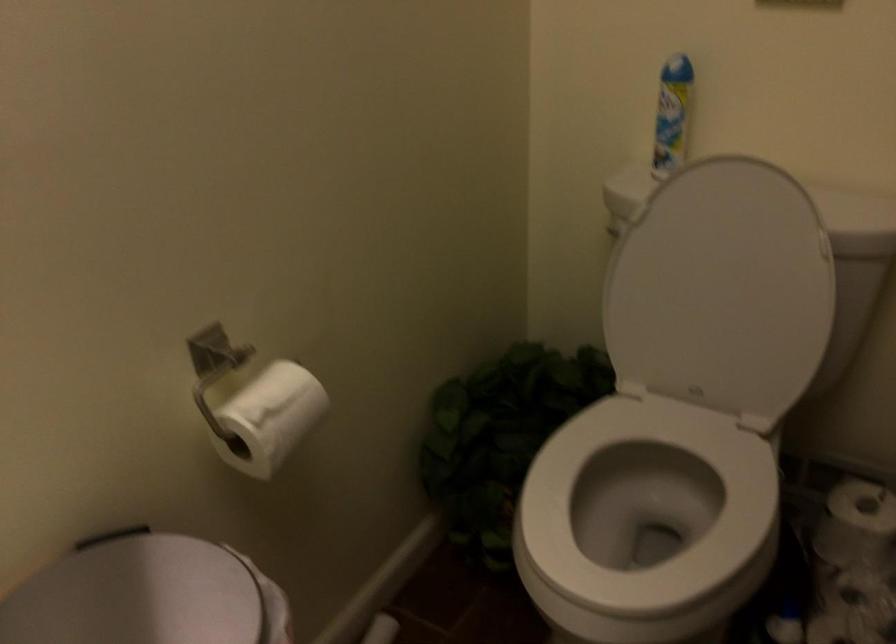
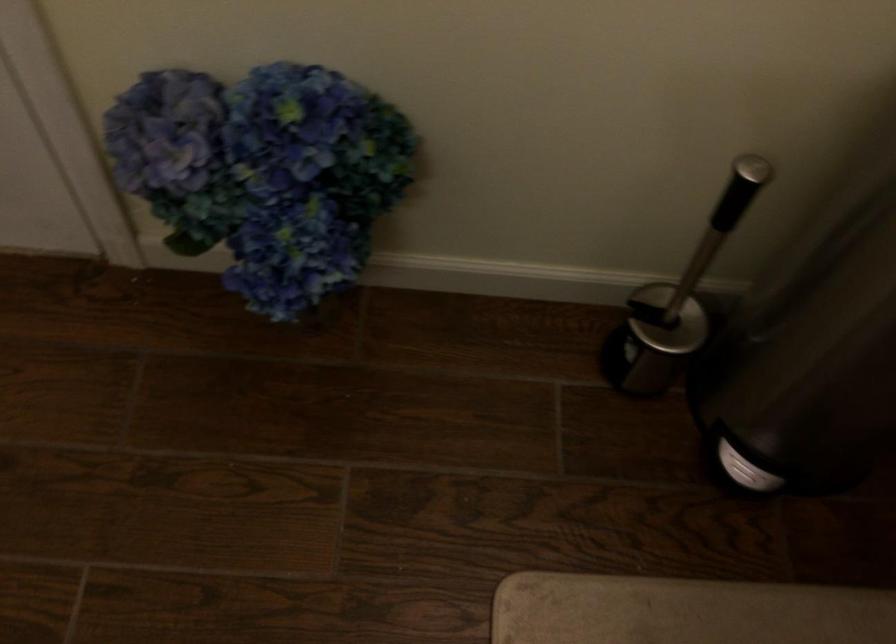
Based on the continuous images, in which direction is the camera rotating?

The camera rotated toward left-down.